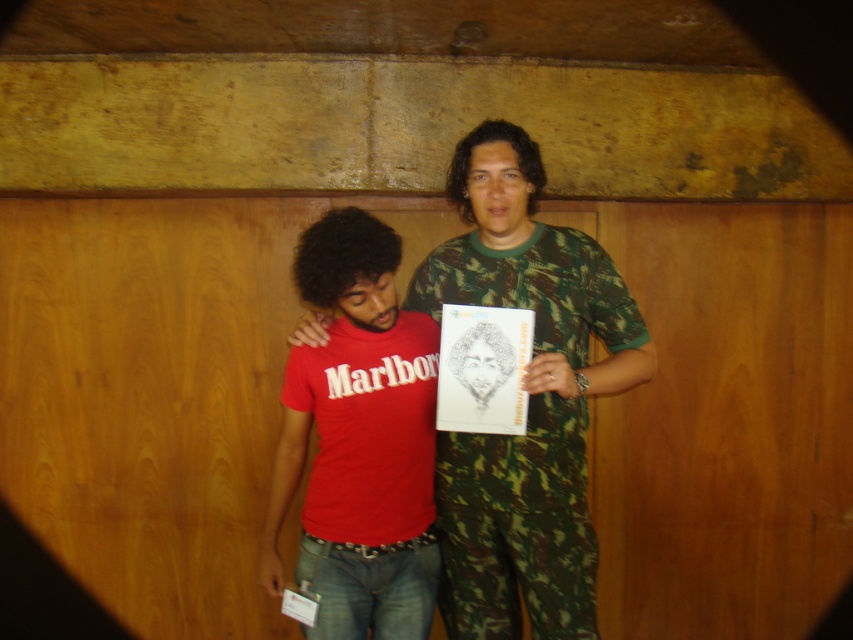
You are an interior designer planning to place a new decorative item in the center of the room. You have a matte black sketchbook at center and a camouflage fabric at center. Which item should you choose if you want the one that is wider?

The camouflage fabric at center is wider than the matte black sketchbook at center, so you should choose the camouflage fabric at center.

You are a photographer setting up for a photoshoot. You want to ensure the red matte shirt at center is visible in the final image. Given that the camouflage fabric at center is in front of it, what adjustment should you make to the camera or subjects?

Since the red matte shirt at center is behind the camouflage fabric at center, you should move the camouflage fabric at center closer to the camera or move the red matte shirt at center further back to ensure it remains visible in the final image.

You are a photographer trying to focus on the red matte shirt at center and the matte black sketchbook at center in the image. Which object should you adjust your camera focus on first if you want to ensure both are in focus?

The red matte shirt at center is closer to the viewer than the matte black sketchbook at center. To ensure both are in focus, you should focus on the matte black sketchbook at center first since it is farther away, allowing the depth of field to cover the closer object as well.